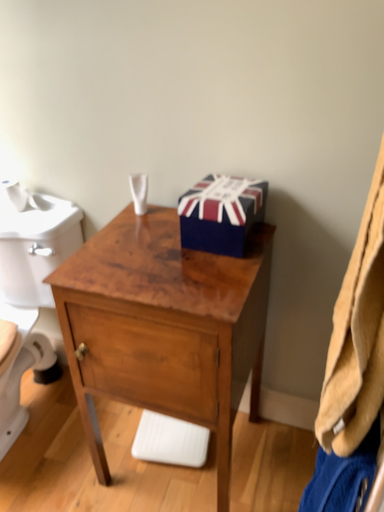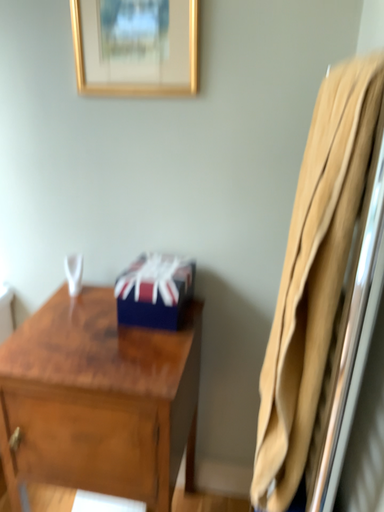
Question: How did the camera likely rotate when shooting the video?

Choices:
 (A) rotated left
 (B) rotated right

Answer: (B)